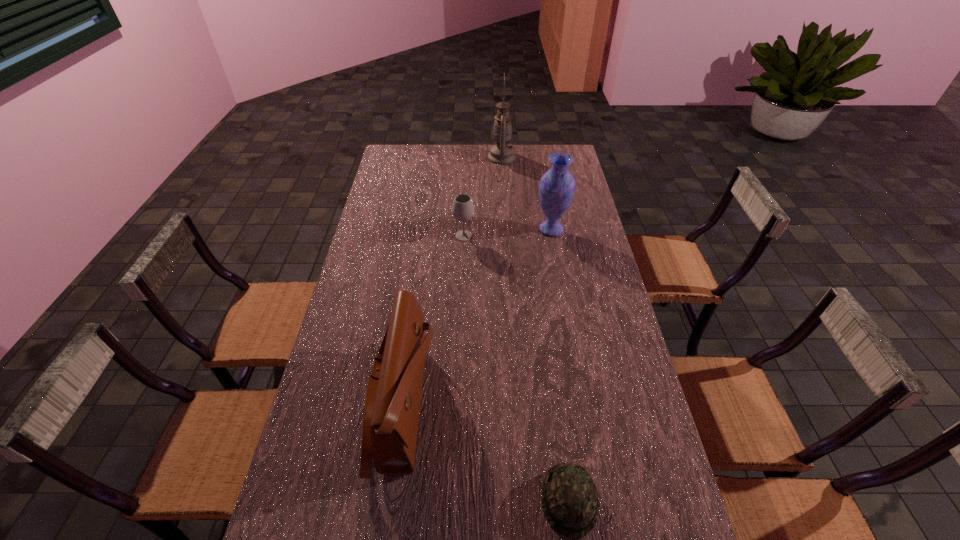
Locate an element on the screen. The height and width of the screenshot is (540, 960). oil lamp is located at coordinates (501, 153).

I want to click on the farthest object, so click(501, 153).

You are a GUI agent. You are given a task and a screenshot of the screen. Output one action in this format:
    pyautogui.click(x=<x>, y=<y>)
    Task: Click on the vase
    
    Given the screenshot: What is the action you would take?
    pyautogui.click(x=557, y=186)

Where is `the leftmost object`? The width and height of the screenshot is (960, 540). the leftmost object is located at coordinates (392, 405).

Identify the location of the fourth object from right to left. This screenshot has width=960, height=540. pyautogui.click(x=462, y=208).

You are a GUI agent. You are given a task and a screenshot of the screen. Output one action in this format:
    pyautogui.click(x=<x>, y=<y>)
    Task: Click on the second shortest object
    Image resolution: width=960 pixels, height=540 pixels.
    Given the screenshot: What is the action you would take?
    click(462, 208)

The width and height of the screenshot is (960, 540). What are the coordinates of `the shortest object` in the screenshot? It's located at (570, 502).

The width and height of the screenshot is (960, 540). What are the coordinates of `free space located 0.090m on the front of the farthest object` in the screenshot? It's located at (503, 177).

Locate an element on the screen. The image size is (960, 540). vacant space located on the left of the vase is located at coordinates (455, 229).

The height and width of the screenshot is (540, 960). Find the location of `vacant region located 0.310m on the front flap of the leftmost object`. vacant region located 0.310m on the front flap of the leftmost object is located at coordinates point(547,404).